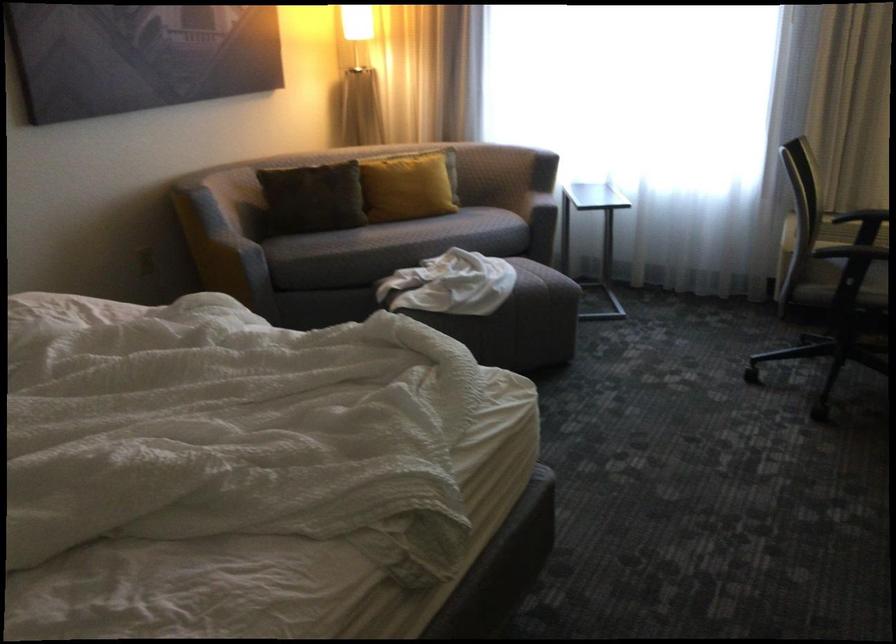
Where is `gray ottoman`? The height and width of the screenshot is (644, 896). gray ottoman is located at coordinates (538, 301).